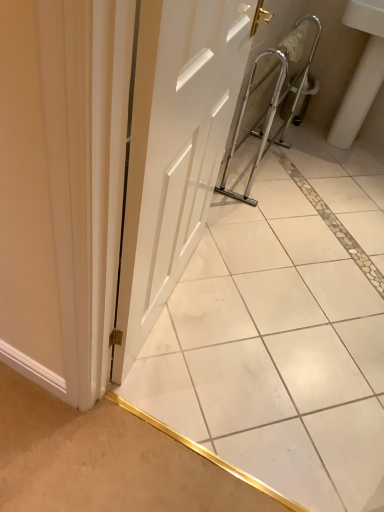
This screenshot has height=512, width=384. I want to click on white glossy tile at center, so click(274, 351).

Locate an element on the screen. The height and width of the screenshot is (512, 384). white ceramic sink at right is located at coordinates (361, 72).

Describe the element at coordinates (175, 149) in the screenshot. I see `white matte door at center` at that location.

What is the approximate width of white matte door at center?

white matte door at center is 3.78 inches wide.

This screenshot has height=512, width=384. Identify the location of white glossy tile at center. (274, 351).

Does point (361, 78) come behind point (175, 269)?

Yes, point (361, 78) is behind point (175, 269).

Is white ceramic sink at right aimed at white matte door at center?

Yes, white ceramic sink at right is aimed at white matte door at center.

Is the surface of white ceramic sink at right in direct contact with white matte door at center?

No, white ceramic sink at right is not making contact with white matte door at center.

I want to click on sink that is on the right side of white matte door at center, so click(361, 72).

Which is more to the left, white matte door at center or white glossy tile at center?

white matte door at center.

Considering the sizes of white matte door at center and white glossy tile at center in the image, is white matte door at center bigger or smaller than white glossy tile at center?

Clearly, white matte door at center is smaller in size than white glossy tile at center.

Is white matte door at center not inside white glossy tile at center?

Absolutely, white matte door at center is external to white glossy tile at center.

Is white matte door at center oriented away from white glossy tile at center?

No, white matte door at center is not facing the opposite direction of white glossy tile at center.

In terms of width, does white matte door at center look wider or thinner when compared to white ceramic sink at right?

In the image, white matte door at center appears to be more narrow than white ceramic sink at right.

From the image's perspective, which is above, white matte door at center or white ceramic sink at right?

white ceramic sink at right is shown above in the image.

Is white matte door at center positioned before white ceramic sink at right?

Yes, white matte door at center is closer to the viewer.

Considering the sizes of white matte door at center and white ceramic sink at right in the image, is white matte door at center taller or shorter than white ceramic sink at right?

white matte door at center is shorter than white ceramic sink at right.

Does white glossy tile at center touch white ceramic sink at right?

No, white glossy tile at center is not with white ceramic sink at right.

This screenshot has height=512, width=384. I want to click on sink on the right of the white glossy tile at center, so click(361, 72).

Considering the positions of objects white glossy tile at center and white ceramic sink at right in the image provided, who is more to the right, white glossy tile at center or white ceramic sink at right?

white ceramic sink at right.

Considering the relative positions of white glossy tile at center and white ceramic sink at right in the image provided, is white glossy tile at center behind white ceramic sink at right?

No, it is in front of white ceramic sink at right.

Are white glossy tile at center and white matte door at center far apart?

No.

Is white glossy tile at center wider than white matte door at center?

Yes, white glossy tile at center is wider than white matte door at center.

Does white glossy tile at center contain white matte door at center?

No, white matte door at center is not a part of white glossy tile at center.

Where is `ceramic tile located above the white ceramic sink at right (from a real-world perspective)`? This screenshot has height=512, width=384. ceramic tile located above the white ceramic sink at right (from a real-world perspective) is located at coordinates (274, 351).

Considering the relative sizes of white ceramic sink at right and white glossy tile at center in the image provided, is white ceramic sink at right shorter than white glossy tile at center?

Yes.

Visually, is white ceramic sink at right positioned to the left or to the right of white glossy tile at center?

Based on their positions, white ceramic sink at right is located to the right of white glossy tile at center.

Which of these two, white ceramic sink at right or white glossy tile at center, is bigger?

white ceramic sink at right.

Find the location of a particular element. This screenshot has width=384, height=512. sink that appears on the right of white matte door at center is located at coordinates (361, 72).

Identify the location of ceramic tile below the white matte door at center (from the image's perspective). Image resolution: width=384 pixels, height=512 pixels. (274, 351).

Based on their spatial positions, is white ceramic sink at right or white glossy tile at center further from white matte door at center?

white ceramic sink at right lies further to white matte door at center than the other object.

Looking at the image, which one is located further to white matte door at center, white glossy tile at center or white ceramic sink at right?

white ceramic sink at right is further to white matte door at center.

Looking at the image, which one is located closer to white glossy tile at center, white ceramic sink at right or white matte door at center?

white matte door at center lies closer to white glossy tile at center than the other object.

Estimate the real-world distances between objects in this image. Which object is closer to white ceramic sink at right, white matte door at center or white glossy tile at center?

Among the two, white glossy tile at center is located nearer to white ceramic sink at right.

When comparing their distances from white ceramic sink at right, does white glossy tile at center or white matte door at center seem further?

white matte door at center is positioned further to the anchor white ceramic sink at right.

In the scene shown: Based on their spatial positions, is white matte door at center or white ceramic sink at right closer to white glossy tile at center?

Based on the image, white matte door at center appears to be nearer to white glossy tile at center.

In order to click on door between white glossy tile at center and white ceramic sink at right from front to back in this screenshot , I will do `click(175, 149)`.